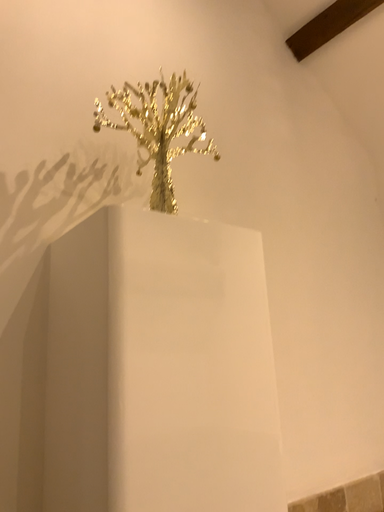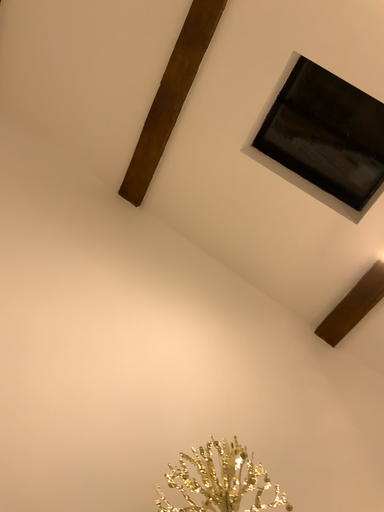
Question: How did the camera likely rotate when shooting the video?

Choices:
 (A) rotated left
 (B) rotated right

Answer: (A)